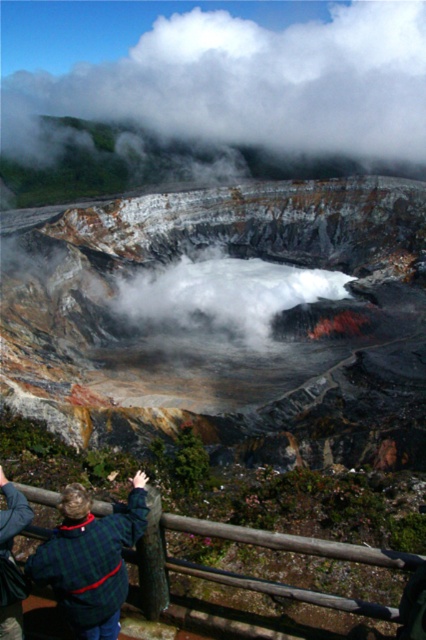
Question: Is volcanic rock crater at center thinner than green plaid shirt at lower left?

Choices:
 (A) yes
 (B) no

Answer: (B)

Question: In this image, where is volcanic rock crater at center located relative to white fluffy cloud at upper center?

Choices:
 (A) right
 (B) left

Answer: (B)

Question: Among these objects, which one is farthest from the camera?

Choices:
 (A) green plaid shirt at lower left
 (B) volcanic rock crater at center

Answer: (B)

Question: Which object appears farthest from the camera in this image?

Choices:
 (A) brown wooden rail at lower center
 (B) white fluffy cloud at upper center
 (C) volcanic rock crater at center

Answer: (B)

Question: Which of the following is the closest to the observer?

Choices:
 (A) (391, 246)
 (B) (196, 532)

Answer: (B)

Question: Does green plaid sweater at lower left come behind green plaid shirt at lower left?

Choices:
 (A) yes
 (B) no

Answer: (B)